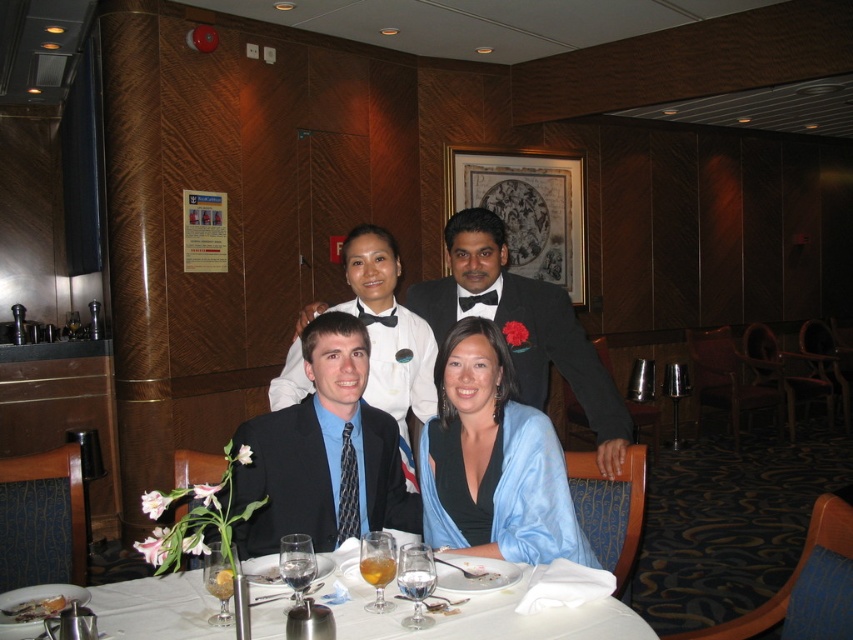
Between point (590, 557) and point (560, 630), which one is positioned behind?

The point (590, 557) is behind.

Is blue satin blouse at center taller than white cloth at lower center?

Indeed, blue satin blouse at center has a greater height compared to white cloth at lower center.

Who is more forward, (494,360) or (471,557)?

Point (471,557)

The height and width of the screenshot is (640, 853). Identify the location of blue satin blouse at center. (492, 461).

Is blue satin blouse at center to the right of black satin bow tie at upper center from the viewer's perspective?

In fact, blue satin blouse at center is to the left of black satin bow tie at upper center.

Which is in front, point (450, 358) or point (584, 339)?

Point (450, 358) is in front.

This screenshot has height=640, width=853. What are the coordinates of `blue satin blouse at center` in the screenshot? It's located at (492, 461).

Is black satin suit at center closer to the viewer compared to blue satin blouse at center?

Yes.

Is point (235, 472) positioned before point (495, 337)?

Yes, it is.

At what (x,y) coordinates should I click in order to perform the action: click on black satin suit at center. Please return your answer as a coordinate pair (x, y). Looking at the image, I should click on (323, 454).